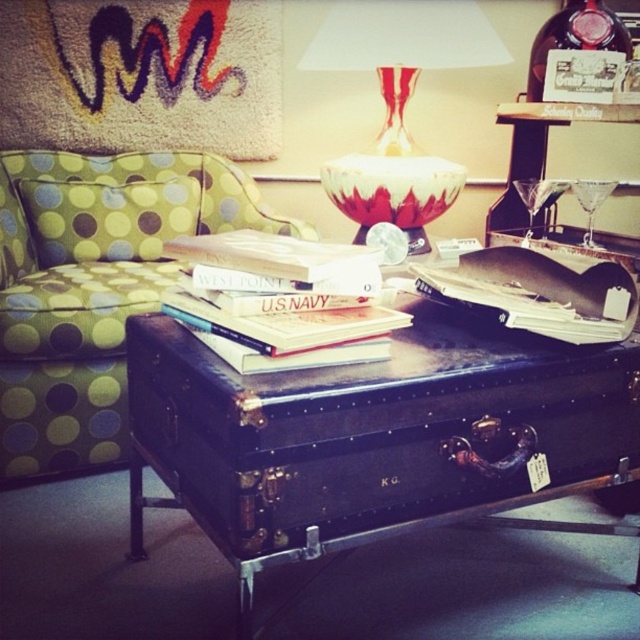
Question: Among these objects, which one is nearest to the camera?

Choices:
 (A) black leather suitcase at center
 (B) hardcover books at center
 (C) red and white glass vase at center

Answer: (A)

Question: Among these objects, which one is farthest from the camera?

Choices:
 (A) green dotted pillow at left
 (B) red and white glass vase at center

Answer: (A)

Question: From the image, what is the correct spatial relationship of black leather suitcase at center in relation to red and white glass vase at center?

Choices:
 (A) below
 (B) above

Answer: (A)

Question: Which object is closer to the camera taking this photo?

Choices:
 (A) green dotted pillow at left
 (B) hardcover books at center
 (C) red and white glass vase at center
 (D) green polka dot fabric couch at left

Answer: (B)

Question: Does red and white glass vase at center come in front of green dotted pillow at left?

Choices:
 (A) no
 (B) yes

Answer: (B)

Question: Is black leather suitcase at center below green dotted pillow at left?

Choices:
 (A) no
 (B) yes

Answer: (B)